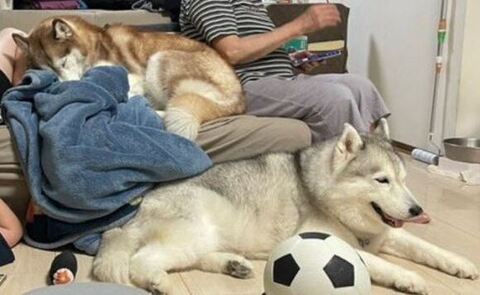
This screenshot has width=480, height=295. I want to click on wall, so click(454, 75).